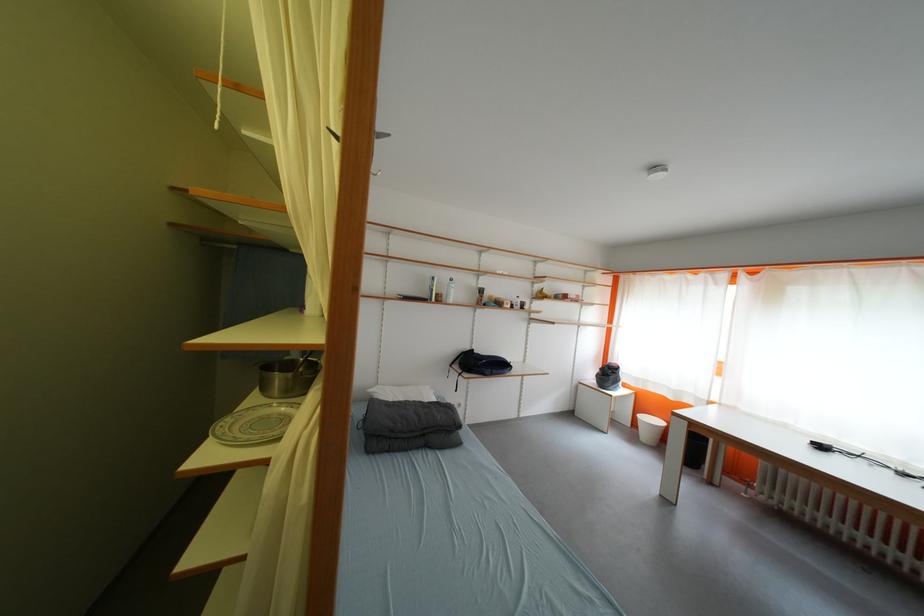
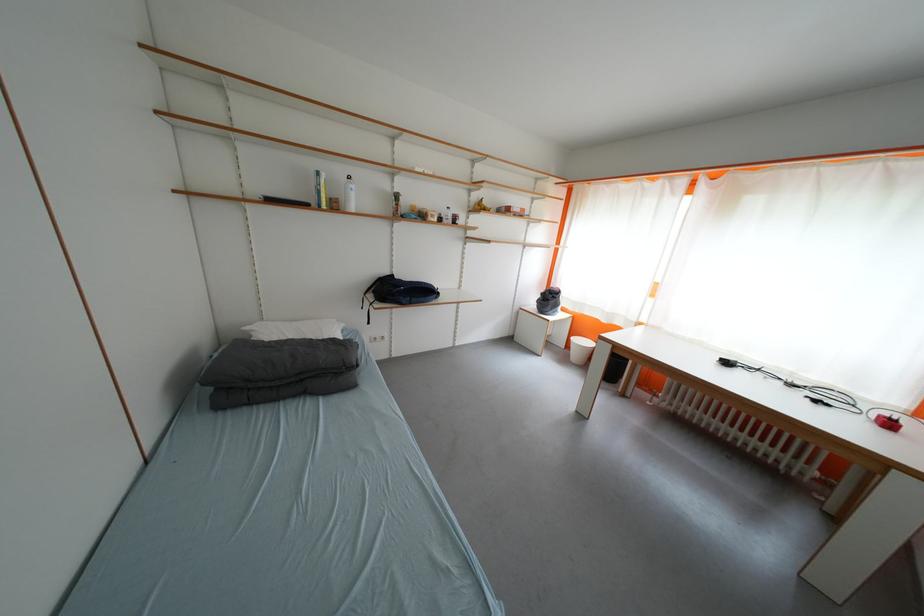
Find the pixel in the second image that matches pixel 380 392 in the first image.

(257, 331)